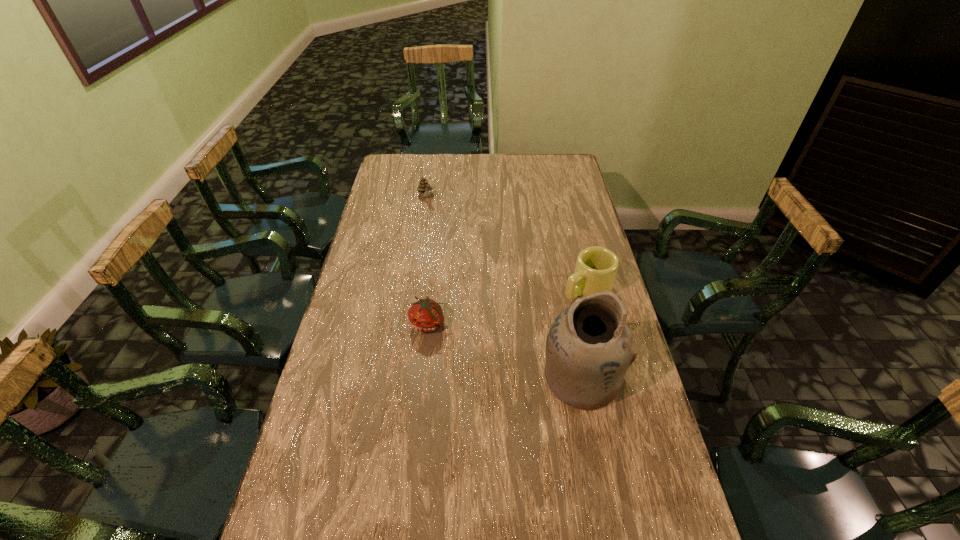
The width and height of the screenshot is (960, 540). What are the coordinates of `free space located 0.090m on the face of the farthest object` in the screenshot? It's located at (433, 216).

At what (x,y) coordinates should I click in order to perform the action: click on free location located 0.110m with the handle on the side of the third nearest object. Please return your answer as a coordinate pair (x, y). This screenshot has height=540, width=960. Looking at the image, I should click on (544, 313).

You are a GUI agent. You are given a task and a screenshot of the screen. Output one action in this format:
    pyautogui.click(x=<x>, y=<y>)
    Task: Click on the vacant space located with the handle on the side of the third nearest object
    This screenshot has width=960, height=540.
    Given the screenshot: What is the action you would take?
    pyautogui.click(x=537, y=318)

Identify the location of free space located with the handle on the side of the third nearest object. The image size is (960, 540). (523, 326).

The image size is (960, 540). I want to click on pottery that is at the right edge, so click(589, 348).

Where is `mug present at the right edge`? The height and width of the screenshot is (540, 960). mug present at the right edge is located at coordinates (596, 267).

Locate an element on the screen. vacant space at the far edge of the desktop is located at coordinates coord(520,159).

At what (x,y) coordinates should I click in order to perform the action: click on vacant space at the left edge. Please return your answer as a coordinate pair (x, y). The image size is (960, 540). Looking at the image, I should click on (388, 209).

Locate an element on the screen. This screenshot has height=540, width=960. vacant area at the right edge of the desktop is located at coordinates (646, 410).

Where is `free space at the near right corner of the desktop`? Image resolution: width=960 pixels, height=540 pixels. free space at the near right corner of the desktop is located at coordinates pyautogui.click(x=660, y=518).